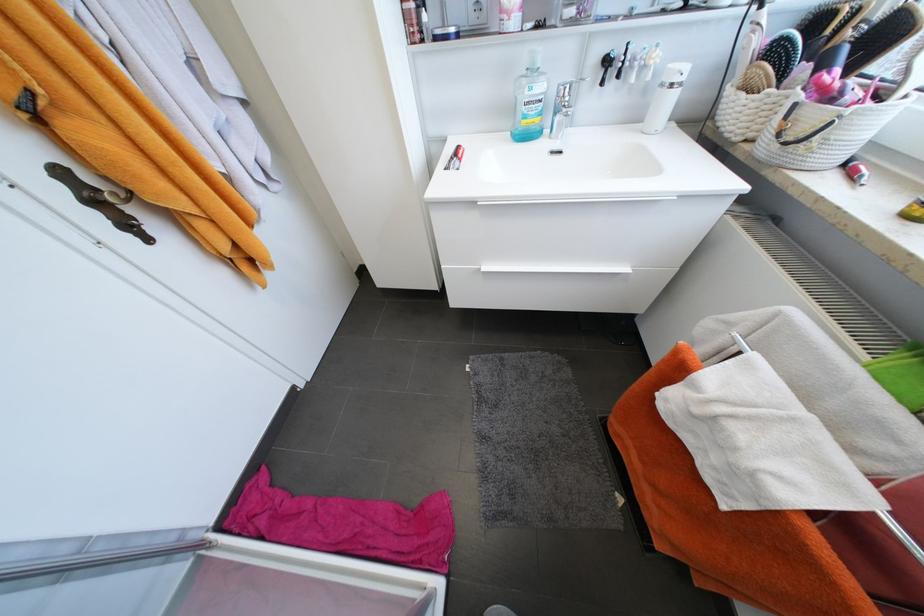
Where is `pink spray nozzle`? pink spray nozzle is located at coordinates (827, 73).